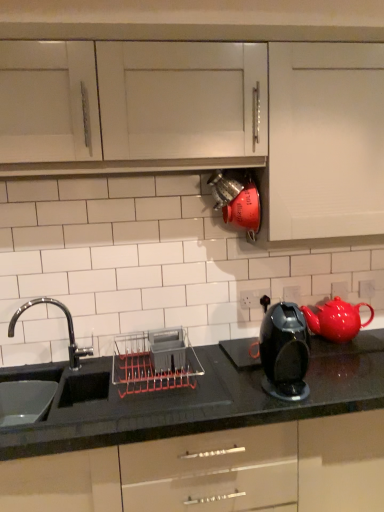
Find the location of a particular element. Image resolution: width=384 pixels, height=512 pixels. vacant space in front of gray plastic dish rack at center is located at coordinates point(157,412).